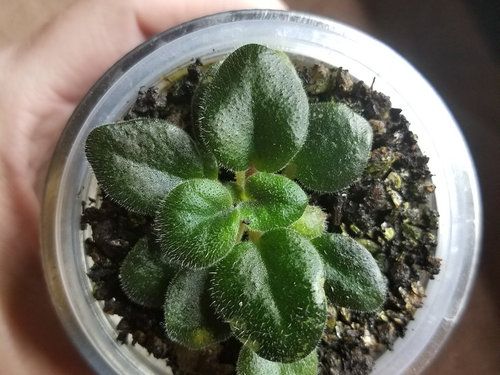
At what (x,y) coordinates should I click in order to perform the action: click on plant. Please return your answer as a coordinate pair (x, y). Image resolution: width=500 pixels, height=375 pixels. Looking at the image, I should click on (254, 296).